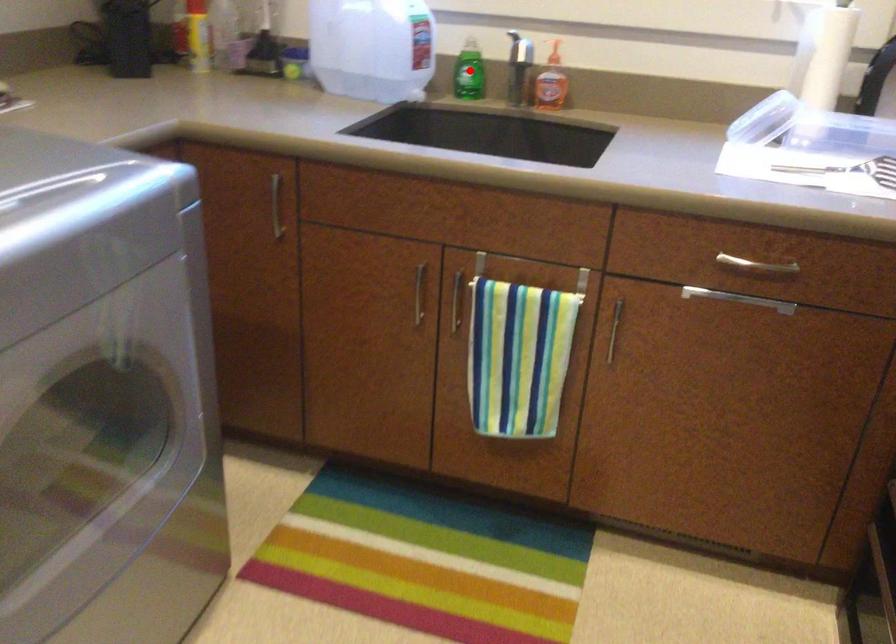
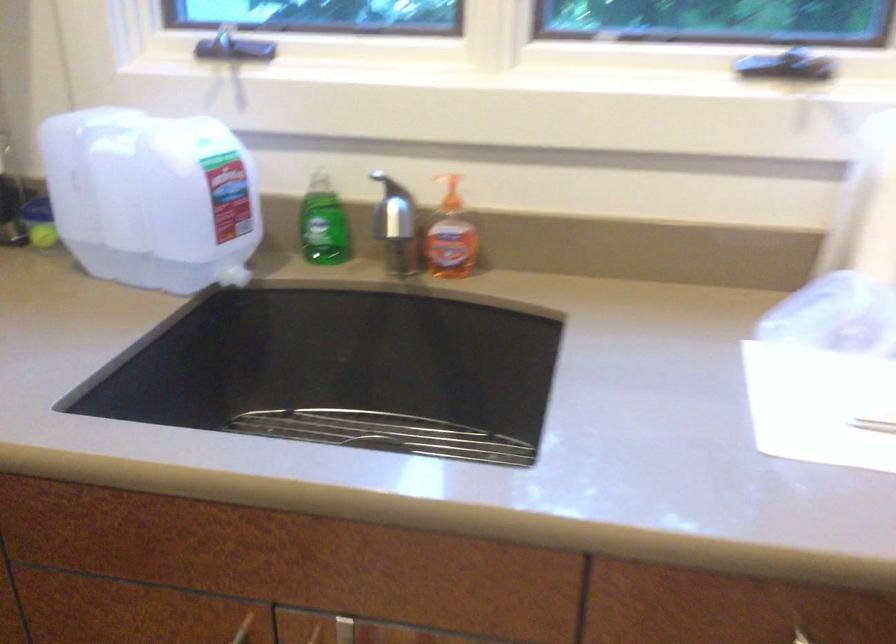
Question: I am providing you with two images of the same scene from different viewpoints. A red point is shown in image1. For the corresponding object point in image2, is it positioned nearer or farther from the camera?

Choices:
 (A) Nearer
 (B) Farther

Answer: (A)